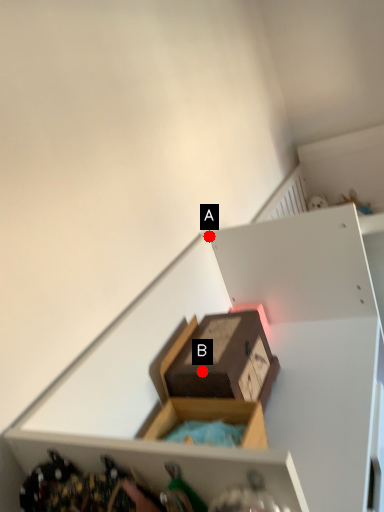
Question: Two points are circled on the image, labeled by A and B beside each circle. Which point is closer to the camera?

Choices:
 (A) A is closer
 (B) B is closer

Answer: (B)